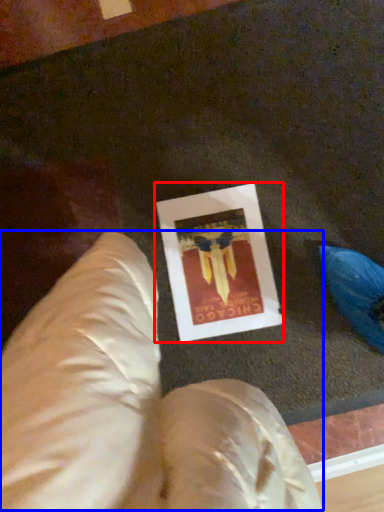
Question: Which of the following is the farthest to the observer, picture frame (highlighted by a red box) or bean bag chair (highlighted by a blue box)?

Choices:
 (A) picture frame
 (B) bean bag chair

Answer: (A)